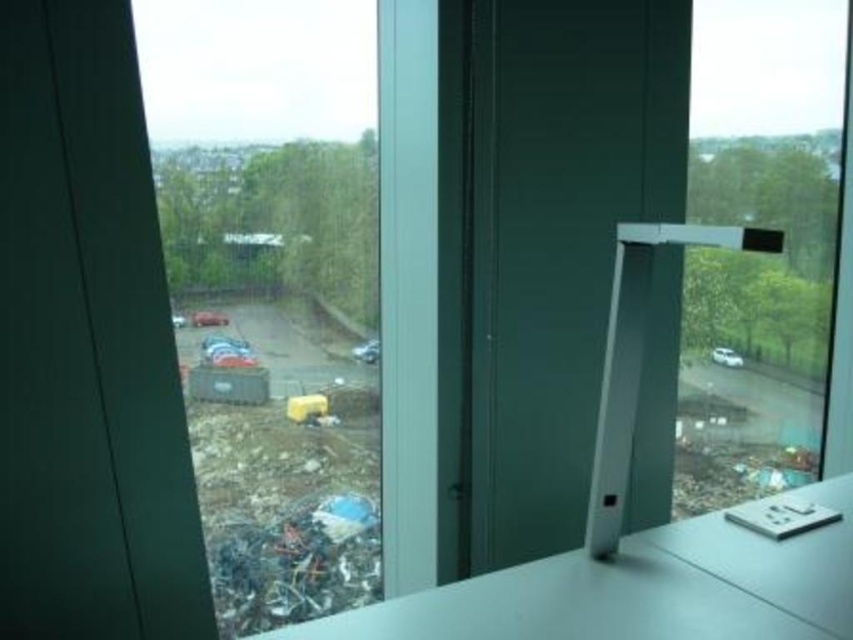
You are sitting at the desk and want to place a small plant between the transparent glass window at center and the white glossy counter top at center. Based on their positions, which object should the plant be closer to?

The transparent glass window at center is positioned on the left side of white glossy counter top at center, so the plant should be placed closer to the transparent glass window at center to be between them.

You are organizing a small event and need to place a centerpiece on the white glossy counter top at center and the white glossy table at lower right. Which surface can accommodate a larger centerpiece?

The white glossy counter top at center can accommodate a larger centerpiece because it is larger in size than the white glossy table at lower right.

You are sitting at the desk and want to see the construction site outside. Which object, the transparent glass window at center or the white glossy counter top at center, is closer to you and allows you to have a better view?

The transparent glass window at center is closer to you than the white glossy counter top at center, so it allows for a better view of the construction site outside.